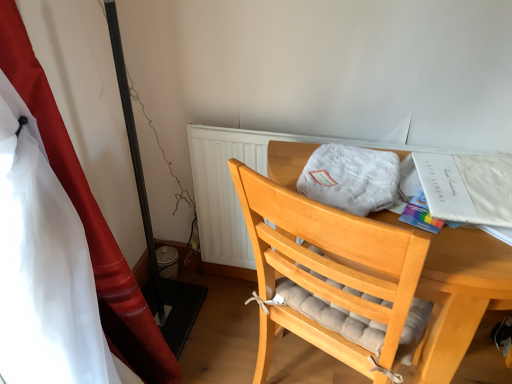
Question: Considering the relative sizes of light wood desk at center and white fluffy blanket at center in the image provided, is light wood desk at center wider than white fluffy blanket at center?

Choices:
 (A) no
 (B) yes

Answer: (B)

Question: Does light wood desk at center lie in front of white fluffy blanket at center?

Choices:
 (A) no
 (B) yes

Answer: (B)

Question: Can we say light wood desk at center lies outside white fluffy blanket at center?

Choices:
 (A) yes
 (B) no

Answer: (A)

Question: Is there a large distance between light wood desk at center and white fluffy blanket at center?

Choices:
 (A) no
 (B) yes

Answer: (A)

Question: Can you confirm if light wood desk at center is thinner than white fluffy blanket at center?

Choices:
 (A) no
 (B) yes

Answer: (A)

Question: Is light wood desk at center behind white fluffy blanket at center?

Choices:
 (A) yes
 (B) no

Answer: (B)

Question: Considering the relative sizes of white fluffy blanket at center and red satin curtain at left in the image provided, is white fluffy blanket at center smaller than red satin curtain at left?

Choices:
 (A) no
 (B) yes

Answer: (B)

Question: Considering the relative sizes of white fluffy blanket at center and red satin curtain at left in the image provided, is white fluffy blanket at center thinner than red satin curtain at left?

Choices:
 (A) no
 (B) yes

Answer: (A)

Question: Could you tell me if white fluffy blanket at center is turned towards red satin curtain at left?

Choices:
 (A) no
 (B) yes

Answer: (A)

Question: From the image's perspective, is white fluffy blanket at center under red satin curtain at left?

Choices:
 (A) no
 (B) yes

Answer: (A)

Question: Is white fluffy blanket at center outside of red satin curtain at left?

Choices:
 (A) no
 (B) yes

Answer: (B)

Question: From a real-world perspective, is white fluffy blanket at center located beneath red satin curtain at left?

Choices:
 (A) yes
 (B) no

Answer: (B)

Question: Is white paper at upper right directly adjacent to red satin curtain at left?

Choices:
 (A) no
 (B) yes

Answer: (A)